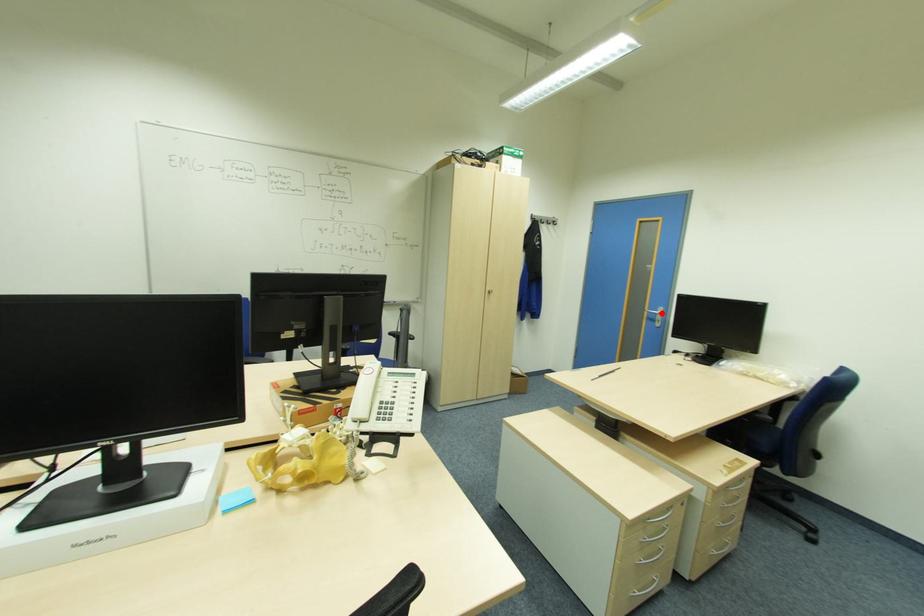
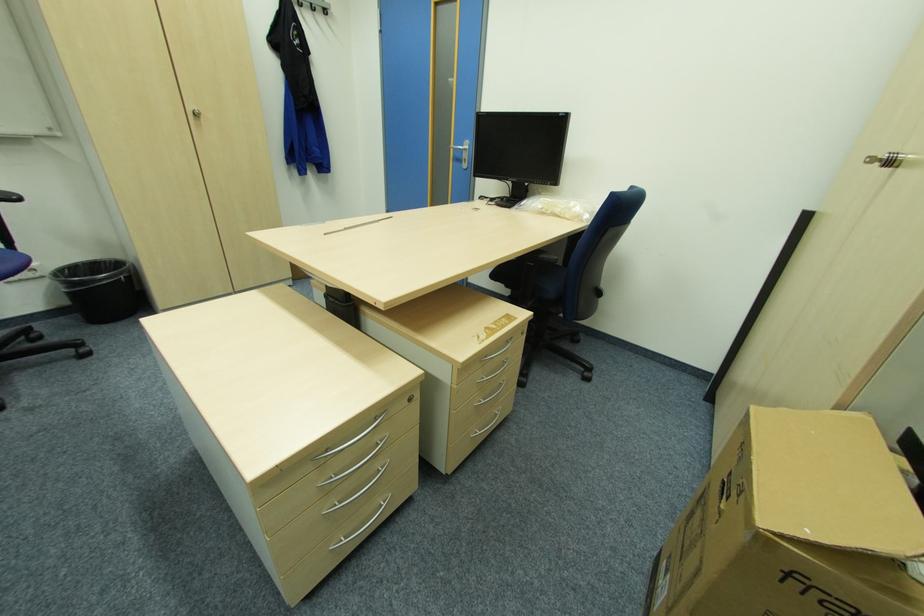
Locate, in the second image, the point that corresponds to the highlighted location in the first image.

(468, 148)